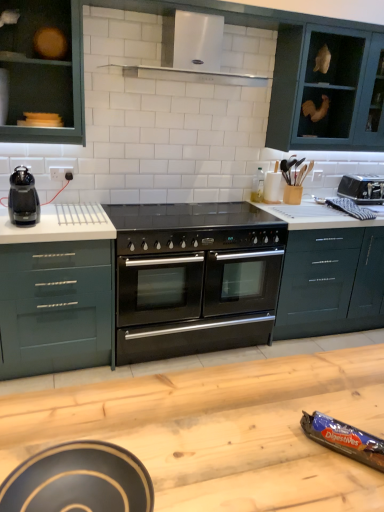
Image resolution: width=384 pixels, height=512 pixels. I want to click on free point behind blue foil digestives at lower right, the second appliance when ordered from bottom to top, so click(326, 393).